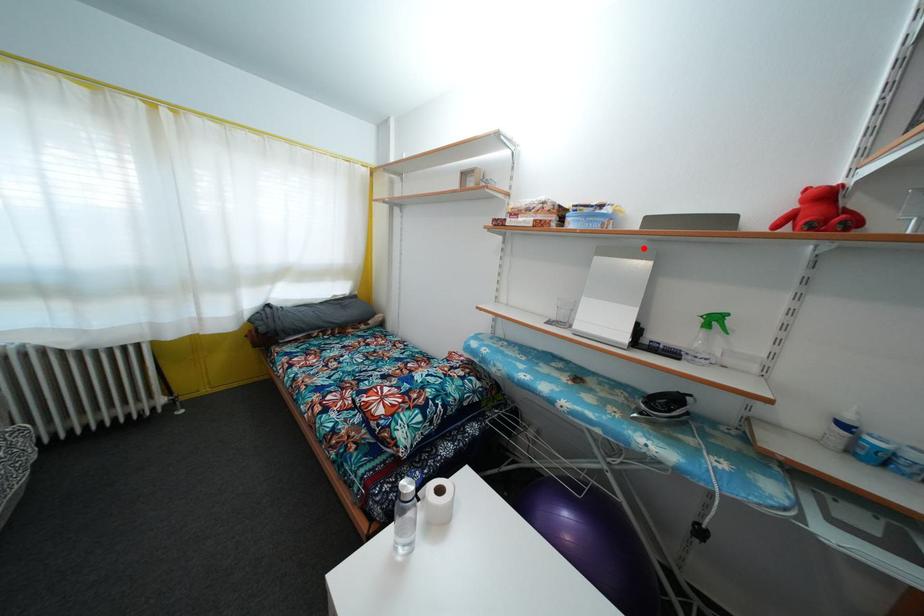
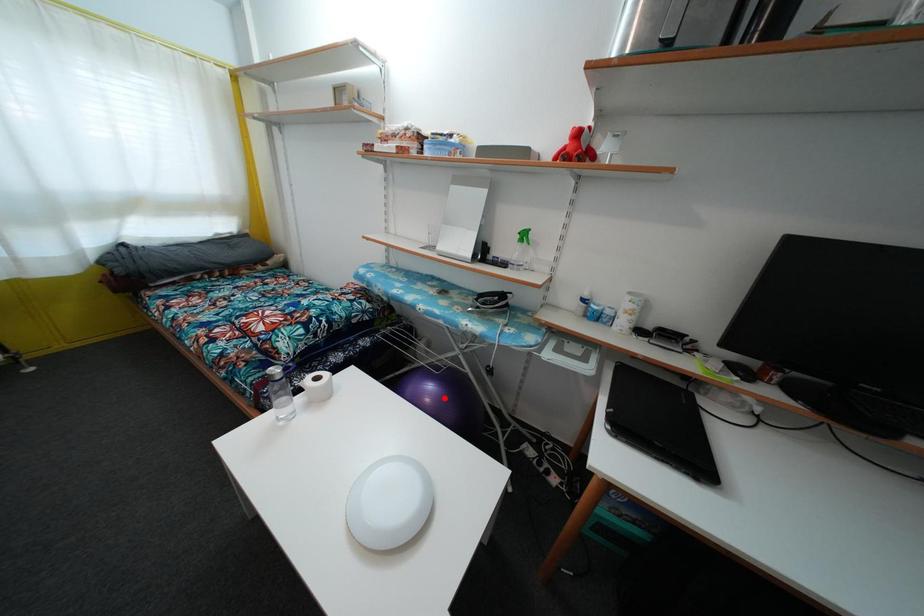
I am providing you with two images of the same scene from different viewpoints. A red point is marked on the first image and another point is marked on the second image. Does the point marked in image1 correspond to the same location as the one in image2?

No